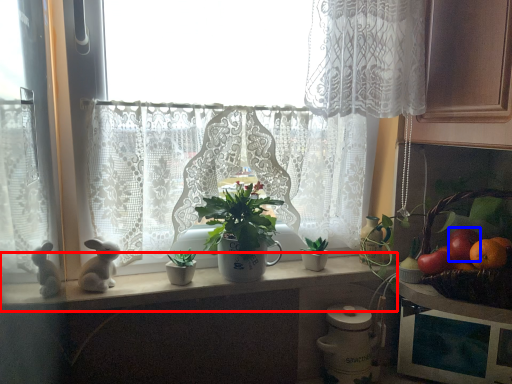
Question: Among these objects, which one is farthest to the camera, counter top (highlighted by a red box) or fruit (highlighted by a blue box)?

Choices:
 (A) counter top
 (B) fruit

Answer: (B)